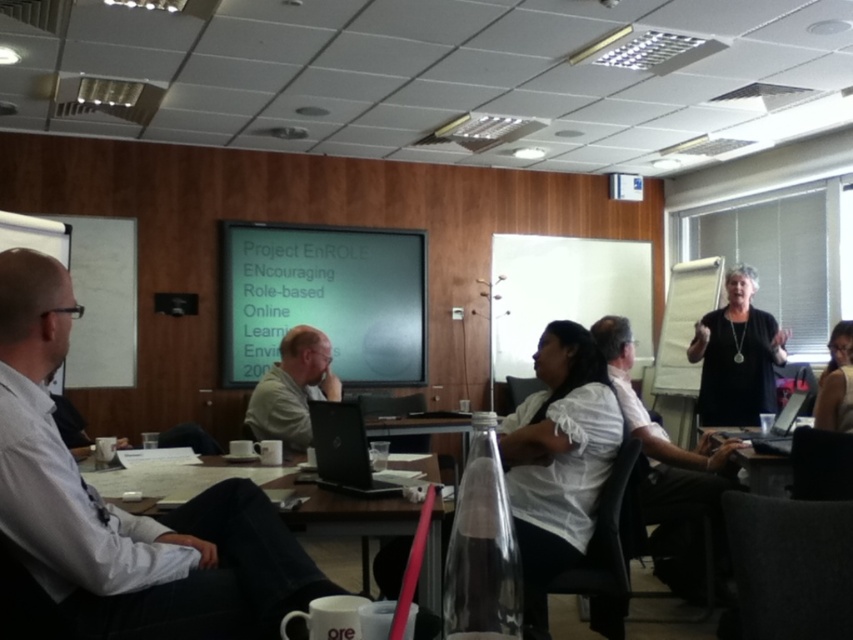
You are a participant in the meeting and need to pass a document to the person wearing the white shirt at center from the wooden table at center. Is the distance between them sufficient for you to comfortably hand the document without getting too close?

The wooden table at center is 1.31 meters from the white shirt at center. This distance is sufficient for comfortably handing over the document without being too close.

From the picture: You are standing at the entrance of the conference room and see the point marked at coordinates (x=669, y=470). Based on the scene description, where is this point located in relation to the participants?

The point at coordinates (x=669, y=470) is located on the white shirt at center.